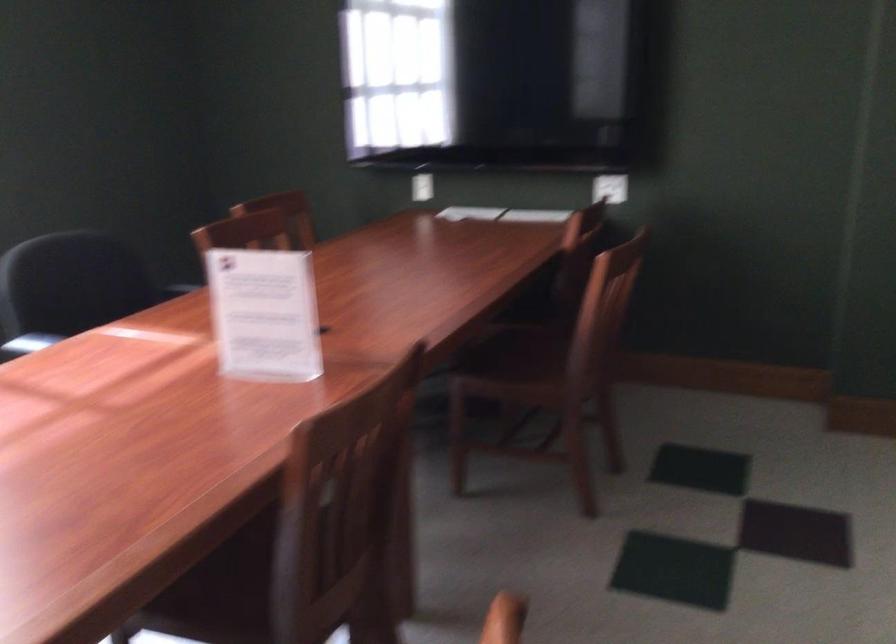
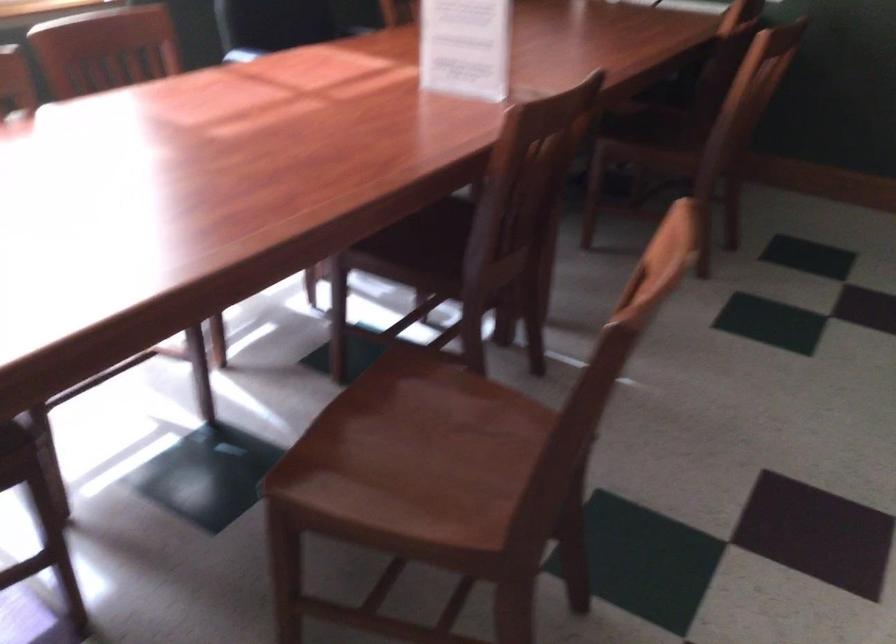
In the second image, find the point that corresponds to point 519,353 in the first image.

(659, 122)